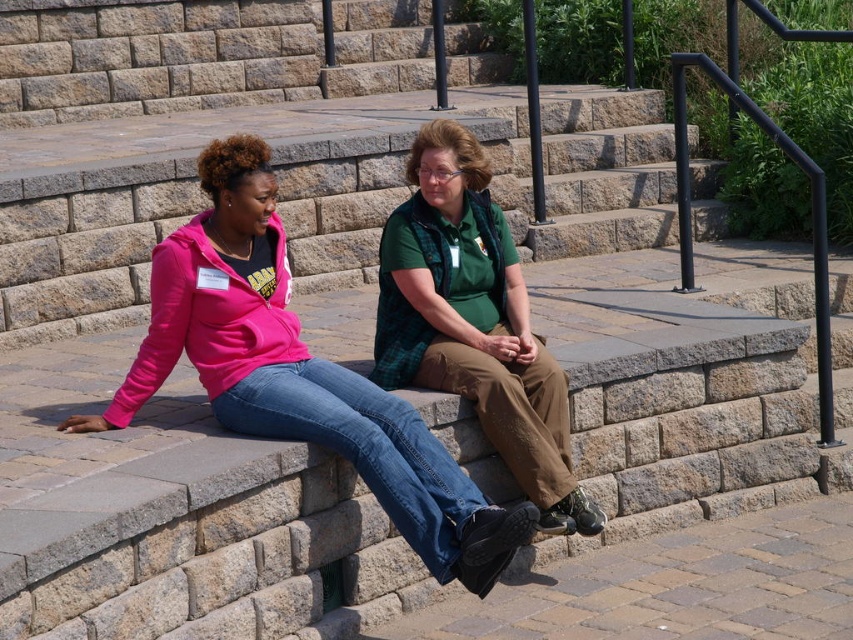
Is point (202, 364) in front of point (439, 336)?

Yes, point (202, 364) is closer to viewer.

Identify the location of matte pink hoodie at center. (299, 372).

This screenshot has height=640, width=853. What do you see at coordinates (299, 372) in the screenshot?
I see `matte pink hoodie at center` at bounding box center [299, 372].

Image resolution: width=853 pixels, height=640 pixels. I want to click on matte pink hoodie at center, so click(299, 372).